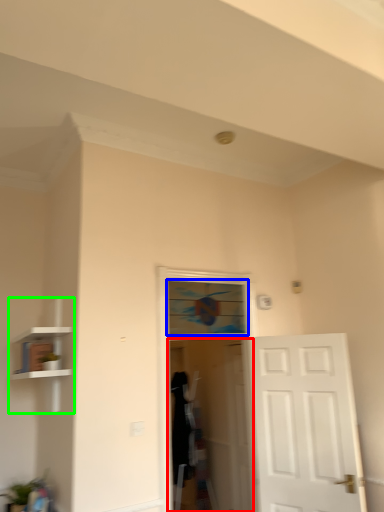
Question: Which is farther away from screen door (highlighted by a red box)? window (highlighted by a blue box) or bookshelf (highlighted by a green box)?

Choices:
 (A) window
 (B) bookshelf

Answer: (B)